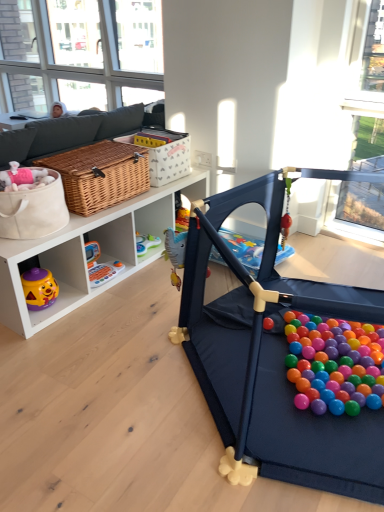
Image resolution: width=384 pixels, height=512 pixels. In order to click on vacant space to the right of rubberized plastic toy at lower left, the first toy from the bottom in this screenshot , I will do `click(125, 275)`.